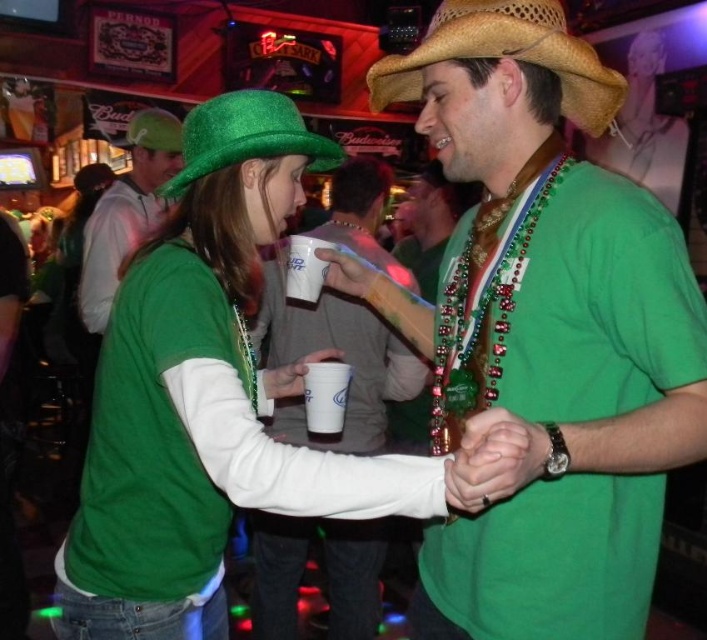
Does shiny green hat at upper left have a greater height compared to green glittery hat at upper left?

Yes.

Who is higher up, shiny green hat at upper left or green glittery hat at upper left?

green glittery hat at upper left is above.

This screenshot has width=707, height=640. What do you see at coordinates (204, 397) in the screenshot? I see `shiny green hat at upper left` at bounding box center [204, 397].

Image resolution: width=707 pixels, height=640 pixels. In order to click on shiny green hat at upper left in this screenshot , I will do `click(204, 397)`.

Does green matte shirt at center appear under straw hat at upper center?

Indeed, green matte shirt at center is positioned under straw hat at upper center.

Does green matte shirt at center lie in front of straw hat at upper center?

Yes, green matte shirt at center is in front of straw hat at upper center.

What do you see at coordinates (542, 333) in the screenshot?
I see `green matte shirt at center` at bounding box center [542, 333].

This screenshot has height=640, width=707. Identify the location of green matte shirt at center. (542, 333).

Between matte green shirt at center and green glittery hat at upper left, which one is positioned higher?

green glittery hat at upper left is above.

Who is lower down, matte green shirt at center or green glittery hat at upper left?

matte green shirt at center is lower down.

Between point (286, 544) and point (264, 99), which one is positioned in front?

Point (264, 99) is in front.

In order to click on matte green shirt at center in this screenshot , I will do `click(341, 358)`.